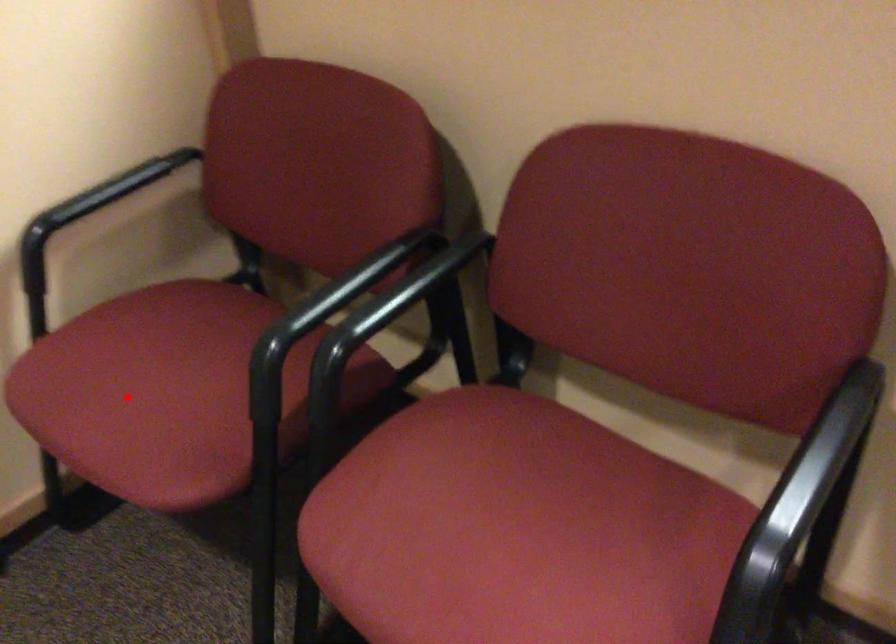
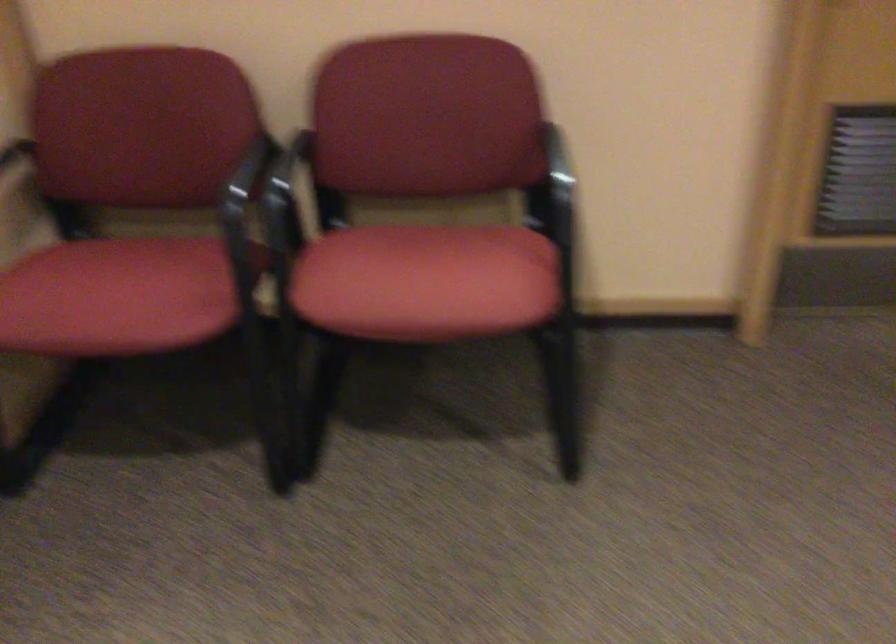
Where in the second image is the point corresponding to the highlighted location from the first image?

(116, 297)